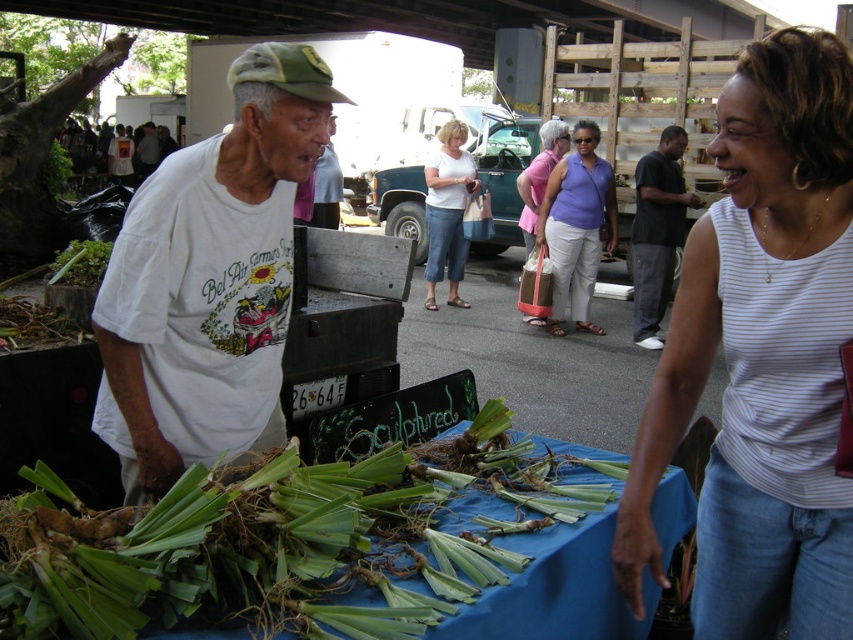
You are standing in the market and want to reach both the point at coordinates point at point (727,128) and the point at point (639,204). Which point do you need to walk towards first to reach the closer one?

You should first walk towards point at point (727,128) because it is closer to you than point at point (639,204).